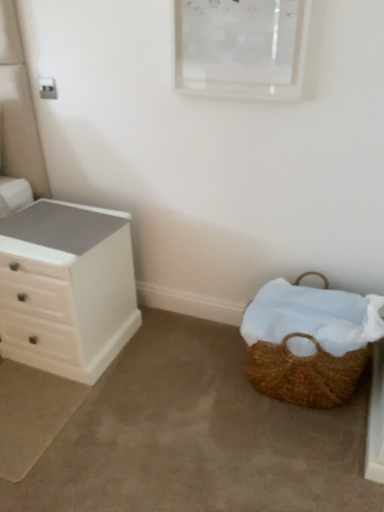
Question: Is white matte chest of drawers at left taller than brown woven picnic basket at lower right?

Choices:
 (A) yes
 (B) no

Answer: (A)

Question: Does white matte chest of drawers at left have a larger size compared to brown woven picnic basket at lower right?

Choices:
 (A) no
 (B) yes

Answer: (B)

Question: Is white matte chest of drawers at left looking in the opposite direction of brown woven picnic basket at lower right?

Choices:
 (A) yes
 (B) no

Answer: (B)

Question: Does white matte chest of drawers at left turn towards brown woven picnic basket at lower right?

Choices:
 (A) yes
 (B) no

Answer: (B)

Question: From the image's perspective, is white matte chest of drawers at left below brown woven picnic basket at lower right?

Choices:
 (A) yes
 (B) no

Answer: (B)

Question: Does white matte chest of drawers at left come in front of brown woven picnic basket at lower right?

Choices:
 (A) no
 (B) yes

Answer: (A)

Question: Can you confirm if brown woven picnic basket at lower right is bigger than white matte chest of drawers at left?

Choices:
 (A) no
 (B) yes

Answer: (A)

Question: Can you confirm if brown woven picnic basket at lower right is wider than white matte chest of drawers at left?

Choices:
 (A) yes
 (B) no

Answer: (B)

Question: Can you confirm if brown woven picnic basket at lower right is smaller than white matte chest of drawers at left?

Choices:
 (A) yes
 (B) no

Answer: (A)

Question: Is the depth of brown woven picnic basket at lower right greater than that of white matte chest of drawers at left?

Choices:
 (A) no
 (B) yes

Answer: (A)

Question: From the image's perspective, is brown woven picnic basket at lower right located above white matte chest of drawers at left?

Choices:
 (A) yes
 (B) no

Answer: (B)

Question: Are brown woven picnic basket at lower right and white matte chest of drawers at left beside each other?

Choices:
 (A) no
 (B) yes

Answer: (A)

Question: From the image's perspective, relative to brown woven picnic basket at lower right, is white matte chest of drawers at left above or below?

Choices:
 (A) above
 (B) below

Answer: (A)